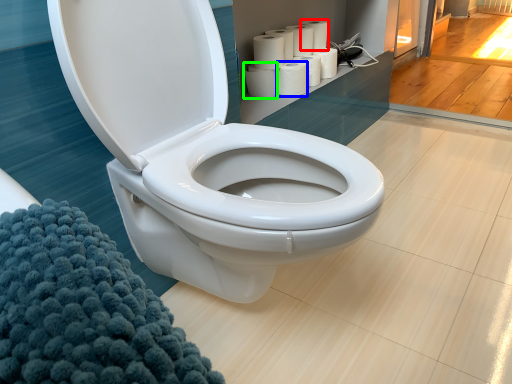
Question: Which object is the farthest from toilet paper (highlighted by a red box)? Choose among these: paper towel (highlighted by a blue box) or paper towel (highlighted by a green box).

Choices:
 (A) paper towel
 (B) paper towel

Answer: (B)